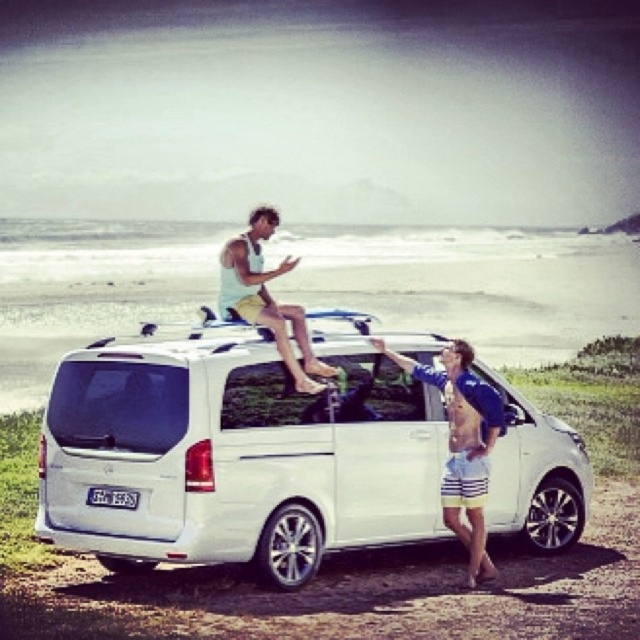
Can you confirm if white matte van at center is shorter than matte white surfboard at upper center?

No.

Does white matte van at center appear over matte white surfboard at upper center?

No.

Between point (250, 438) and point (268, 225), which one is positioned in front?

Point (250, 438) is in front.

This screenshot has height=640, width=640. I want to click on white matte van at center, so click(x=236, y=456).

Which of these two, white matte van at center or white matte surfboard at upper center, stands shorter?

Standing shorter between the two is white matte surfboard at upper center.

Locate an element on the screen. This screenshot has width=640, height=640. white matte van at center is located at coordinates pos(236,456).

Image resolution: width=640 pixels, height=640 pixels. What are the coordinates of `white matte van at center` in the screenshot? It's located at (236, 456).

From the picture: Does white matte surfboard at upper center have a larger size compared to matte white surfboard at upper center?

Yes.

Can you confirm if white matte surfboard at upper center is taller than matte white surfboard at upper center?

Correct, white matte surfboard at upper center is much taller as matte white surfboard at upper center.

Is point (468, 417) more distant than point (275, 308)?

No, it is in front of (275, 308).

This screenshot has width=640, height=640. I want to click on white matte surfboard at upper center, so click(x=461, y=444).